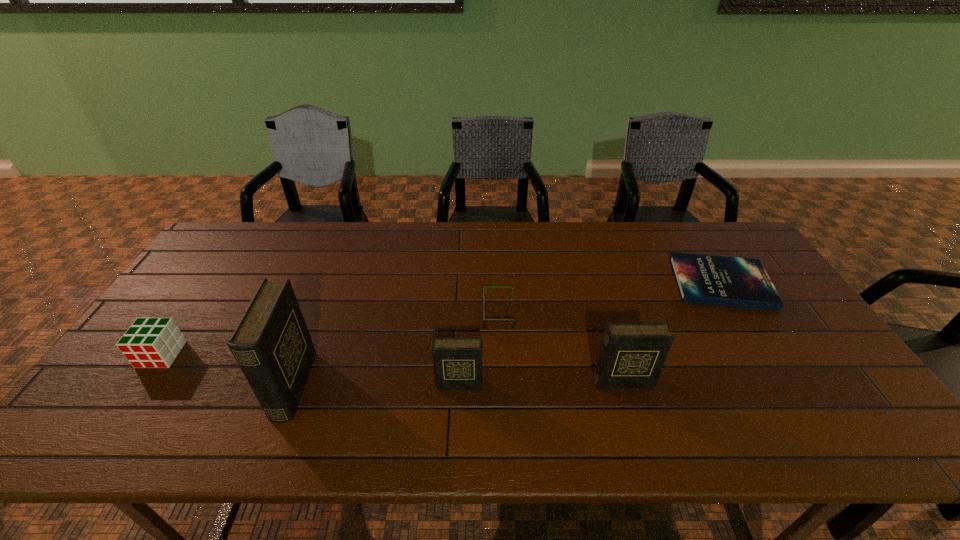
Locate an element on the screen. Image resolution: width=960 pixels, height=540 pixels. vacant space that satisfies the following two spatial constraints: 1. on the lens of the fifth tallest object; 2. on the front cover of the fourth shortest object is located at coordinates (501, 383).